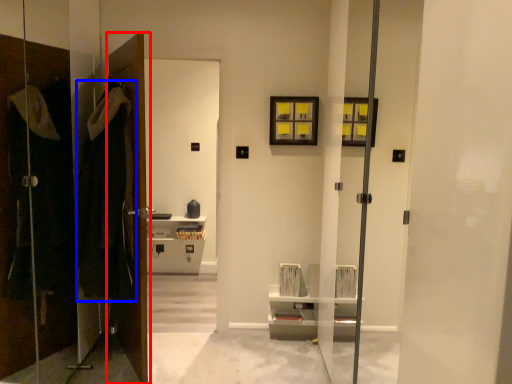
Question: Which point is closer to the camera, door (highlighted by a red box) or robe (highlighted by a blue box)?

Choices:
 (A) door
 (B) robe

Answer: (B)